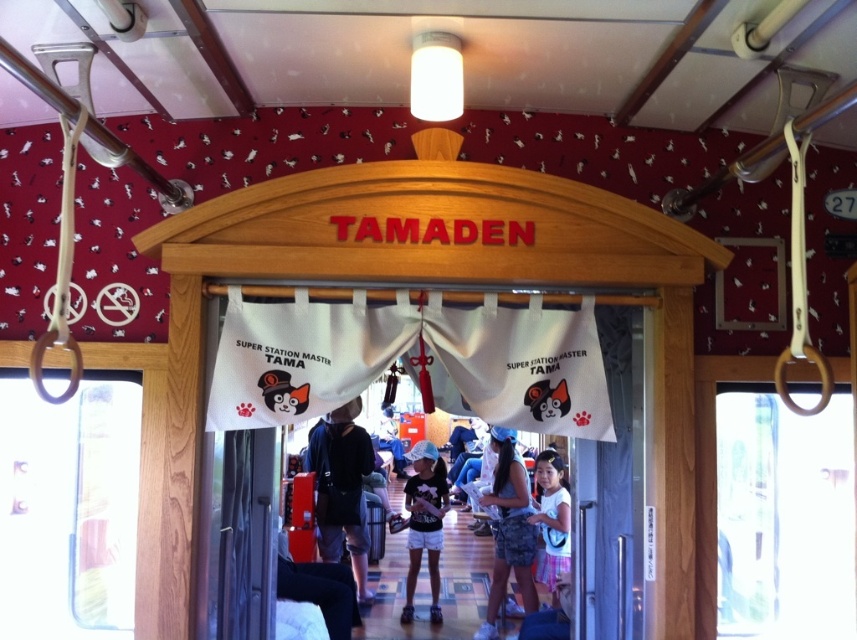
In the scene shown: You are standing inside the train car and looking at the two points marked in the image. Which point, point [556,340] or point [555,515], is closer to you?

Point [556,340] is closer to the camera than point [555,515], so it is closer to you.

You are a passenger on the train and want to take a photo of both the white fabric banner at center and the white cotton dress at lower right. Since you have limited space on your camera roll, you want to know which object takes up more area in the photo. Which one is larger?

The white cotton dress at lower right occupies more space than the white fabric banner at center, so it will take up a larger area in the photo.